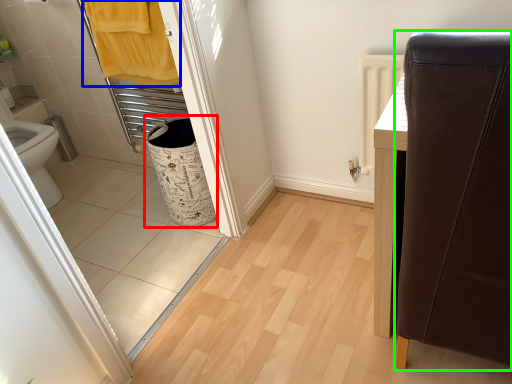
Question: Estimate the real-world distances between objects in this image. Which object is farther from laundry basket (highlighted by a red box), bath towel (highlighted by a blue box) or furniture (highlighted by a green box)?

Choices:
 (A) bath towel
 (B) furniture

Answer: (B)